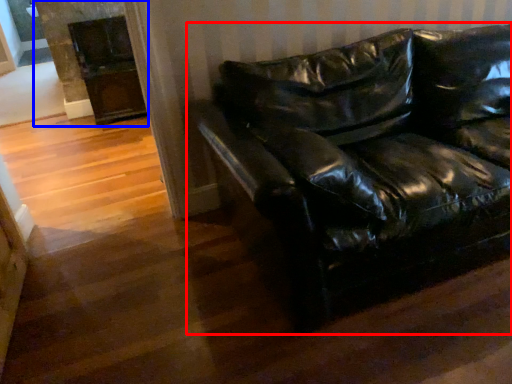
Question: Which point is further to the camera, studio couch (highlighted by a red box) or fireplace (highlighted by a blue box)?

Choices:
 (A) studio couch
 (B) fireplace

Answer: (B)